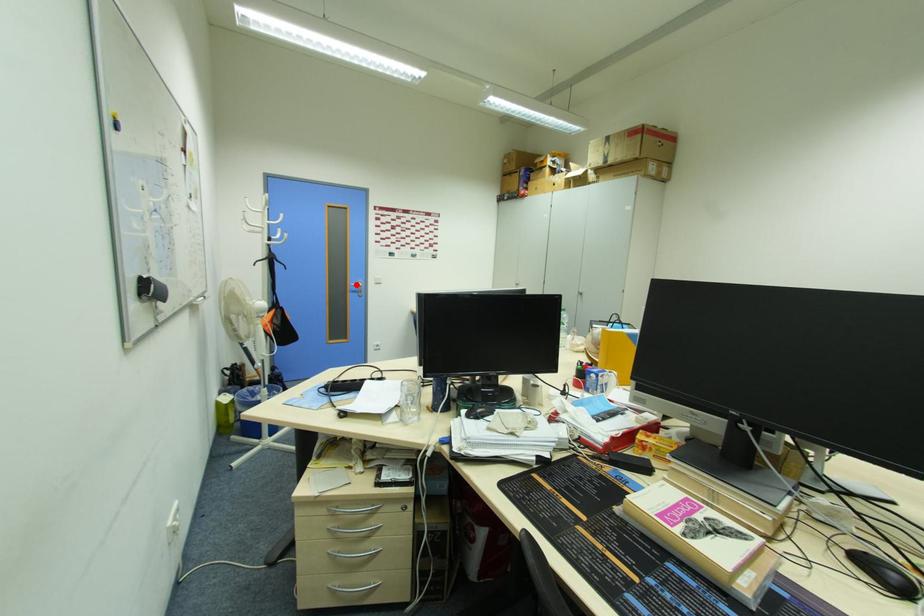
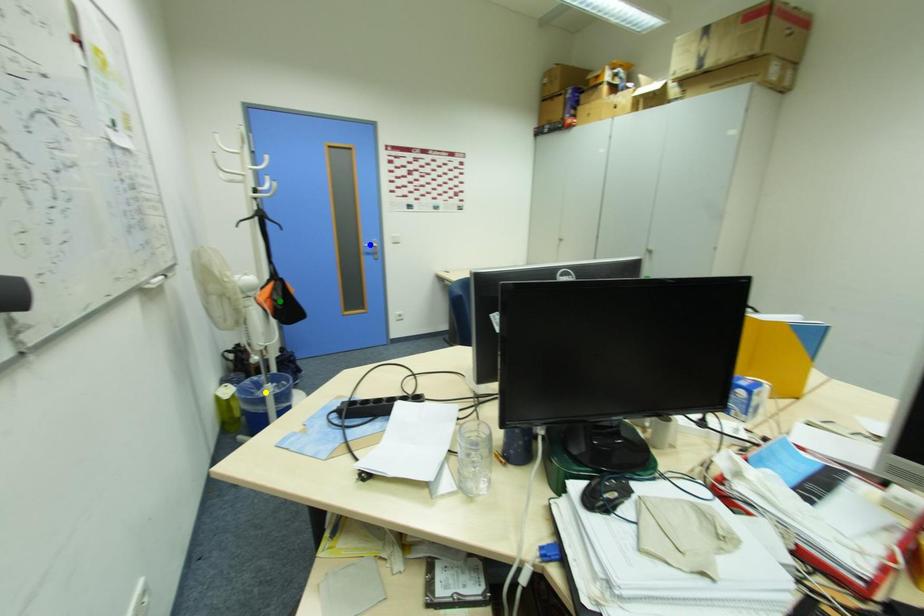
Question: I am providing you with two images of the same scene from different viewpoints. A red point is marked on the first image. You are given multiple points on the second image. Which point in image 2 is actually the same real-world point as the red point in image 1?

Choices:
 (A) green point
 (B) yellow point
 (C) blue point

Answer: (C)